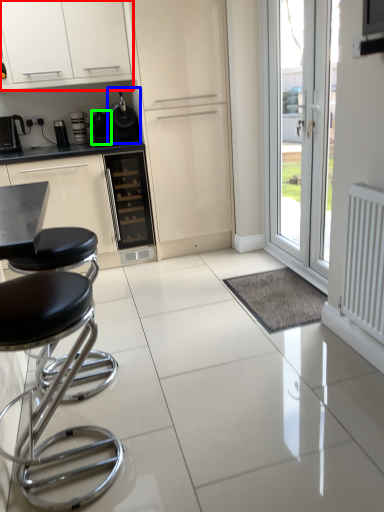
Question: Which object is the closest to the cabinetry (highlighted by a red box)? Choose among these: appliance (highlighted by a blue box) or appliance (highlighted by a green box).

Choices:
 (A) appliance
 (B) appliance

Answer: (A)